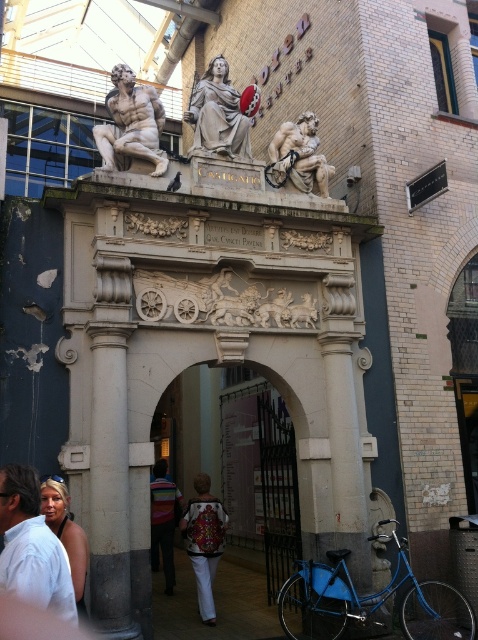
Question: Estimate the real-world distances between objects in this image. Which object is farther from the striped shirt at center?

Choices:
 (A) embroidered fabric jacket at center
 (B) white marble statue at upper center

Answer: (B)

Question: Does white marble statue at upper center appear on the right side of matte gray statue at center?

Choices:
 (A) no
 (B) yes

Answer: (A)

Question: Can you confirm if light brown hair at lower left is positioned below white marble statue at upper center?

Choices:
 (A) no
 (B) yes

Answer: (B)

Question: Among these objects, which one is nearest to the camera?

Choices:
 (A) rough stone sculpture at center
 (B) striped shirt at center

Answer: (A)

Question: Among these objects, which one is nearest to the camera?

Choices:
 (A) matte gray statue at center
 (B) striped shirt at center
 (C) matte black tank top at lower left
 (D) white marble statue at upper center

Answer: (C)

Question: Is white marble statue at upper center closer to the viewer compared to matte gray statue at center?

Choices:
 (A) yes
 (B) no

Answer: (A)